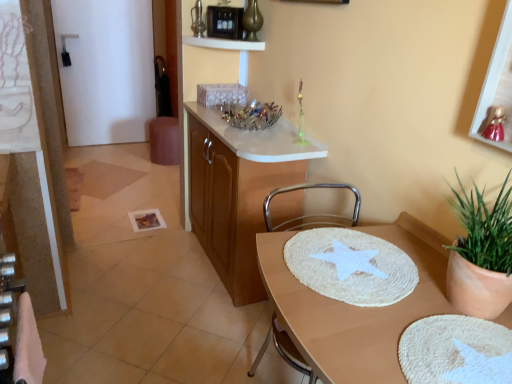
This screenshot has height=384, width=512. What are the coordinates of `space that is in front of white woven mat at center` in the screenshot? It's located at (407, 342).